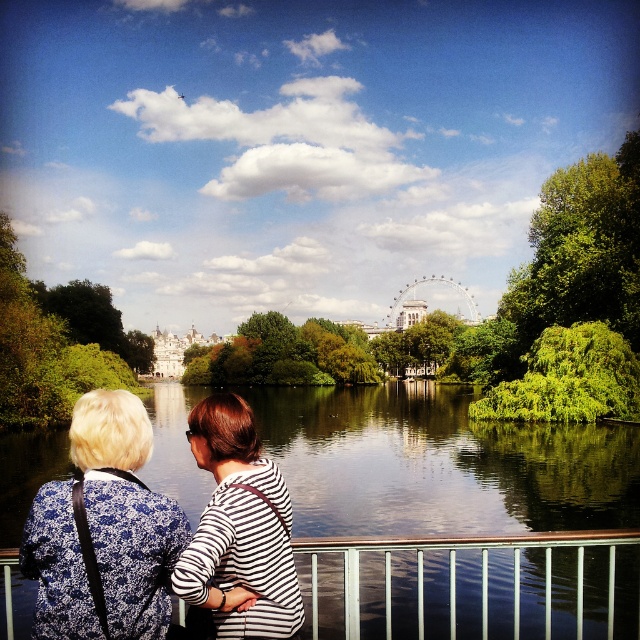
You are a photographer trying to capture the reflection of the blue floral blouse at upper left in the transparent glass water at center. Based on the scene, is this possible?

The transparent glass water at center is located above the blue floral blouse at upper left, so the reflection would not be visible because the blouse is below the water level.

You are a photographer trying to capture a clear shot of the blue floral blouse at upper left and the transparent glass water at center. Which object should you focus on first to ensure both are in focus?

You should focus on the transparent glass water at center first because the blue floral blouse at upper left is behind it, so focusing on the closer object will help both be in focus.